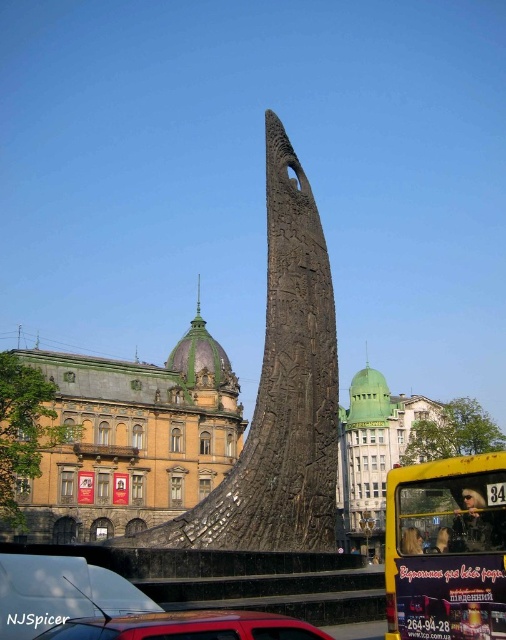
You are a tour guide leading a group to the metallic red car at lower left from the black textured stone monument at center. Can you walk directly to the car without any obstacles in between?

The distance between the black textured stone monument at center and metallic red car at lower left is 47.50 feet, so yes, you can walk directly to the car without any obstacles in between.

You are a tourist standing at the base of the tall stone monument. You notice a point marked at coordinates (446, 548). What object is located at this point?

The point at coordinates (446, 548) marks the location of the yellow matte decorative bus at lower right.